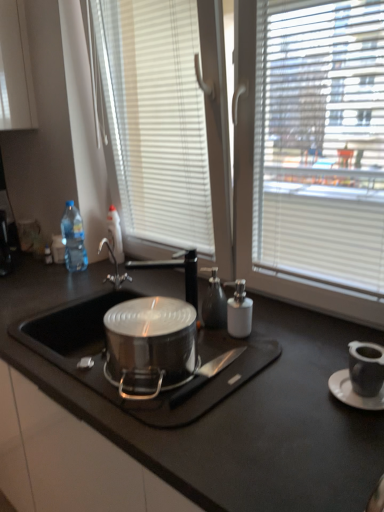
What do you see at coordinates (228, 409) in the screenshot? I see `black matte countertop at center` at bounding box center [228, 409].

In order to face black matte countertop at center, should I rotate leftwards or rightwards?

Rotate left and turn 4.367 degrees.

I want to click on black matte tap at center, so [176, 267].

Identify the location of white ceramic saucer at lower right. This screenshot has height=512, width=384. (353, 393).

The image size is (384, 512). I want to click on translucent plastic bottle at upper left, positioned as the 1th bottle in right-to-left order, so click(115, 234).

The image size is (384, 512). In order to click on transparent plastic bottle at left, the 1th bottle positioned from the left in this screenshot , I will do `click(73, 239)`.

At what (x,y) coordinates should I click in order to perform the action: click on black matte countertop at center. Please return your answer as a coordinate pair (x, y). Looking at the image, I should click on (228, 409).

Considering the sizes of objects black matte tap at center and black matte knife at center in the image provided, who is wider, black matte tap at center or black matte knife at center?

black matte knife at center is wider.

Looking at this image, considering the relative positions of black matte tap at center and black matte knife at center in the image provided, is black matte tap at center to the right of black matte knife at center from the viewer's perspective?

Incorrect, black matte tap at center is not on the right side of black matte knife at center.

Is black matte tap at center taller or shorter than black matte knife at center?

Clearly, black matte tap at center is taller compared to black matte knife at center.

From the image's perspective, which one is positioned higher, black matte tap at center or black matte knife at center?

black matte tap at center is shown above in the image.

Considering the relative positions of black matte knife at center and black matte tap at center in the image provided, is black matte knife at center to the left or to the right of black matte tap at center?

black matte knife at center is to the right of black matte tap at center.

Measure the distance from black matte knife at center to black matte tap at center.

22.86 inches.

I want to click on knife below the black matte tap at center (from the image's perspective), so click(205, 375).

Would you say black matte knife at center is outside black matte tap at center?

That's correct, black matte knife at center is outside of black matte tap at center.

Is black matte tap at center at the left side of black matte countertop at center?

Yes, black matte tap at center is to the left of black matte countertop at center.

From the image's perspective, would you say black matte tap at center is shown under black matte countertop at center?

No.

Would you say black matte tap at center is outside black matte countertop at center?

Indeed, black matte tap at center is completely outside black matte countertop at center.

Considering the sizes of objects black matte tap at center and black matte countertop at center in the image provided, who is bigger, black matte tap at center or black matte countertop at center?

Bigger between the two is black matte countertop at center.

From a real-world perspective, which is physically below, white ceramic saucer at lower right or translucent plastic bottle at upper left, positioned as the 1th bottle in right-to-left order?

white ceramic saucer at lower right, from a real-world perspective.

Could translucent plastic bottle at upper left, which is the 2th bottle in left-to-right order, be considered to be inside white ceramic saucer at lower right?

No.

Is white ceramic saucer at lower right far from translucent plastic bottle at upper left, which is the 2th bottle in left-to-right order?

Yes, white ceramic saucer at lower right and translucent plastic bottle at upper left, which is the 2th bottle in left-to-right order, are located far from each other.

Which is more to the left, white ceramic saucer at lower right or translucent plastic bottle at upper left, which is the 2th bottle in left-to-right order?

Positioned to the left is translucent plastic bottle at upper left, which is the 2th bottle in left-to-right order.

Is black matte countertop at center with white ceramic saucer at lower right?

No, black matte countertop at center is not beside white ceramic saucer at lower right.

In the scene shown: Is the position of black matte countertop at center less distant than that of white ceramic saucer at lower right?

Yes, it is.

Considering the relative sizes of black matte countertop at center and white ceramic saucer at lower right in the image provided, is black matte countertop at center smaller than white ceramic saucer at lower right?

No, black matte countertop at center is not smaller than white ceramic saucer at lower right.

Does point (233, 483) come farther from viewer compared to point (360, 398)?

No, it is not.

Identify the location of the 2nd bottle to the left of the black matte countertop at center, counting from the anchor's position. This screenshot has height=512, width=384. (73, 239).

Consider the image. Which is correct: transparent plastic bottle at left, the 1th bottle positioned from the left, is inside black matte countertop at center, or outside of it?

transparent plastic bottle at left, the 1th bottle positioned from the left, exists outside the volume of black matte countertop at center.

In terms of size, does transparent plastic bottle at left, acting as the second bottle starting from the right, appear bigger or smaller than black matte countertop at center?

Considering their sizes, transparent plastic bottle at left, acting as the second bottle starting from the right, takes up less space than black matte countertop at center.

Is black matte knife at center positioned with its back to glossy ceramic mug at upper right?

No, glossy ceramic mug at upper right is not at the back of black matte knife at center.

Considering their positions, is black matte knife at center located in front of or behind glossy ceramic mug at upper right?

In the image, black matte knife at center appears behind glossy ceramic mug at upper right.

Is black matte knife at center taller or shorter than glossy ceramic mug at upper right?

Clearly, black matte knife at center is shorter compared to glossy ceramic mug at upper right.

The image size is (384, 512). In order to click on tap lying on the left of black matte knife at center in this screenshot , I will do `click(176, 267)`.

Identify the location of knife that appears below the black matte tap at center (from the image's perspective). (205, 375).

From the image, which object appears to be farther from transparent plastic bottle at left, the 1th bottle positioned from the left, translucent plastic bottle at upper left, positioned as the 1th bottle in right-to-left order, or white ceramic saucer at lower right?

white ceramic saucer at lower right is further to transparent plastic bottle at left, the 1th bottle positioned from the left.

Based on the photo, considering their positions, is black matte tap at center positioned closer to white ceramic saucer at lower right than black matte countertop at center?

black matte countertop at center is positioned closer to the anchor white ceramic saucer at lower right.

Which object lies nearer to the anchor point black matte knife at center, black matte tap at center or black matte countertop at center?

black matte countertop at center lies closer to black matte knife at center than the other object.

Estimate the real-world distances between objects in this image. Which object is further from black matte countertop at center, glossy ceramic mug at upper right or translucent plastic bottle at upper left, positioned as the 1th bottle in right-to-left order?

Among the two, translucent plastic bottle at upper left, positioned as the 1th bottle in right-to-left order, is located further to black matte countertop at center.

Which object lies nearer to the anchor point glossy ceramic mug at upper right, black matte knife at center or black matte tap at center?

black matte knife at center is closer to glossy ceramic mug at upper right.

When comparing their distances from black matte countertop at center, does translucent plastic bottle at upper left, which is the 2th bottle in left-to-right order, or glossy ceramic mug at upper right seem further?

translucent plastic bottle at upper left, which is the 2th bottle in left-to-right order, is positioned further to the anchor black matte countertop at center.

Which object lies further to the anchor point black matte tap at center, black matte countertop at center or glossy ceramic mug at upper right?

glossy ceramic mug at upper right.

Looking at the image, which one is located further to glossy ceramic mug at upper right, black matte countertop at center or transparent plastic bottle at left, acting as the second bottle starting from the right?

Based on the image, transparent plastic bottle at left, acting as the second bottle starting from the right, appears to be further to glossy ceramic mug at upper right.

Where is `tap between black matte knife at center and translucent plastic bottle at upper left, positioned as the 1th bottle in right-to-left order, in the front-back direction`? This screenshot has height=512, width=384. tap between black matte knife at center and translucent plastic bottle at upper left, positioned as the 1th bottle in right-to-left order, in the front-back direction is located at coordinates (x=176, y=267).

Find the location of a particular element. The image size is (384, 512). appliance between black matte countertop at center and black matte tap at center from front to back is located at coordinates (366, 368).

At what (x,y) coordinates should I click in order to perform the action: click on bottle between white ceramic saucer at lower right and translucent plastic bottle at upper left, which is the 2th bottle in left-to-right order, in the front-back direction. Please return your answer as a coordinate pair (x, y). The width and height of the screenshot is (384, 512). Looking at the image, I should click on pyautogui.click(x=73, y=239).

At what (x,y) coordinates should I click in order to perform the action: click on saucer between black matte countertop at center and translucent plastic bottle at upper left, positioned as the 1th bottle in right-to-left order, along the z-axis. Please return your answer as a coordinate pair (x, y). This screenshot has width=384, height=512. Looking at the image, I should click on (353, 393).